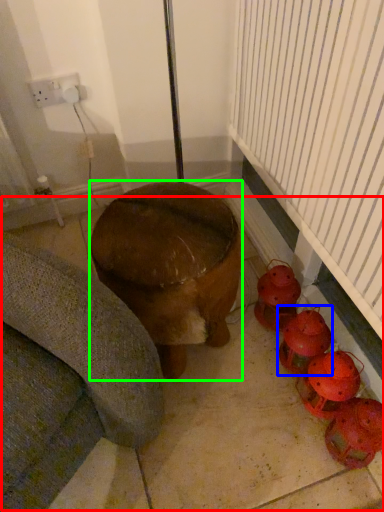
Question: Considering the real-world distances, which object is closest to concrete (highlighted by a red box)? toy (highlighted by a blue box) or furniture (highlighted by a green box).

Choices:
 (A) toy
 (B) furniture

Answer: (A)